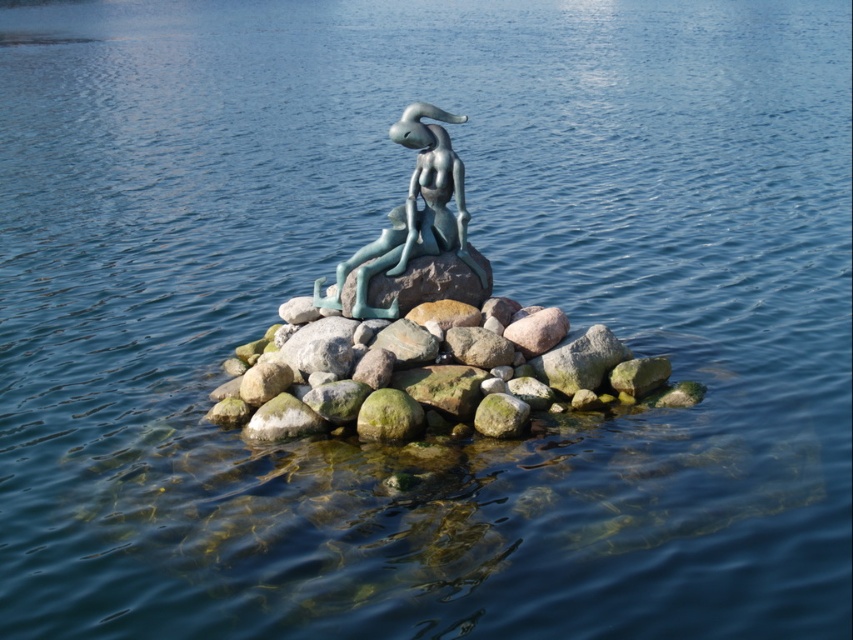
You are a visitor standing on the edge of the water, looking at the smooth gray rock at center and the green patina statue at center. Which object is taller?

The green patina statue at center is taller than the smooth gray rock at center.

You are an artist planning to paint the sculpture scene. You need to know the relative positions of the smooth gray rock at center and the green patina statue at center to ensure accuracy. Which object is located to the right of the other?

The smooth gray rock at center is positioned on the right side of green patina statue at center, so the smooth gray rock at center is to the right of the green patina statue at center.

You are observing the sculpture from a boat anchored in the water. You notice two points marked on the sculpture. The first point is at coordinates point (x=357, y=422) and the second is at point (x=440, y=195). Which of these two points appears closer to you?

Point (x=357, y=422) is closer to the camera than point (x=440, y=195), so the first point appears closer to you.